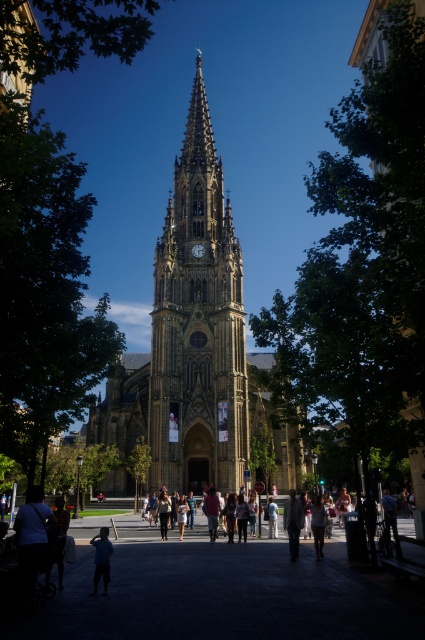
You are standing in the square in front of the cathedral and see the light beige fabric jacket at center. If you walk directly towards the cathedral, will you pass the point marked by point (292,522)?

Yes, walking directly towards the cathedral from your current position in the square, you will pass the point marked by point (292,522) because the light beige fabric jacket at center is located along your path towards the cathedral.

You are a photographer standing in the square in front of the cathedral. You notice a person wearing a blue fabric shirt at lower left and light blue denim jeans at center. Which piece of clothing is positioned farther to the left?

The blue fabric shirt at lower left is positioned farther to the left compared to the light blue denim jeans at center.

You are a photographer standing in the square in front of the cathedral. You want to take a photo that includes both the light beige fabric jacket at center and the dark brown stone clock at center. Which object should you zoom in on to ensure both are clearly visible in the frame?

You should zoom in on the dark brown stone clock at center because the light beige fabric jacket at center is larger in size than the dark brown stone clock at center, so focusing on the smaller object will help fit both into the frame.